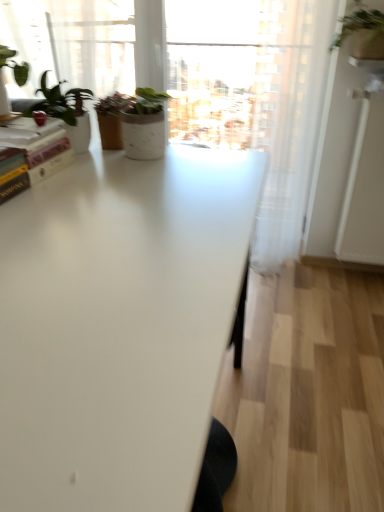
What is the approximate width of white glossy table at center?

white glossy table at center is 30.93 inches wide.

Where is `hardcover book at upper left`? Image resolution: width=384 pixels, height=512 pixels. hardcover book at upper left is located at coordinates (31, 157).

Describe the element at coordinates (365, 185) in the screenshot. I see `white glossy screen door at right` at that location.

The image size is (384, 512). Describe the element at coordinates (225, 70) in the screenshot. I see `transparent glass window at upper center` at that location.

You are a GUI agent. You are given a task and a screenshot of the screen. Output one action in this format:
    pyautogui.click(x=<x>, y=<y>)
    Task: Click on the green matte plant at upper right
    
    Given the screenshot: What is the action you would take?
    pyautogui.click(x=363, y=31)

Is there a large distance between white glossy table at center and green matte plant pot at upper left?

That's right, there is a large distance between white glossy table at center and green matte plant pot at upper left.

How far apart are white glossy table at center and green matte plant pot at upper left?

white glossy table at center and green matte plant pot at upper left are 4.89 feet apart from each other.

Between white glossy table at center and green matte plant pot at upper left, which one has more height?

With more height is white glossy table at center.

Considering the relative sizes of white glossy table at center and green matte plant pot at upper left in the image provided, is white glossy table at center thinner than green matte plant pot at upper left?

No.

Is white glossy table at center not close to green matte plant at upper right?

Yes.

How much distance is there between white glossy table at center and green matte plant at upper right?

A distance of 5.01 feet exists between white glossy table at center and green matte plant at upper right.

Does point (163, 245) lie behind point (371, 36)?

No.

What's the angular difference between white glossy table at center and green matte plant at upper right's facing directions?

They differ by 90 degrees in their facing directions.

Does green matte plant pot at upper left have a greater width compared to white glossy screen door at right?

Indeed, green matte plant pot at upper left has a greater width compared to white glossy screen door at right.

Is green matte plant pot at upper left aimed at white glossy screen door at right?

No, green matte plant pot at upper left is not turned towards white glossy screen door at right.

Considering the relative positions of green matte plant pot at upper left and white glossy screen door at right in the image provided, is green matte plant pot at upper left to the right of white glossy screen door at right from the viewer's perspective?

Incorrect, green matte plant pot at upper left is not on the right side of white glossy screen door at right.

Could white glossy screen door at right be considered to be inside green matte plant pot at upper left?

No, white glossy screen door at right is located outside of green matte plant pot at upper left.

Is point (89, 414) closer or farther from the camera than point (190, 18)?

Point (89, 414) is closer to the camera than point (190, 18).

Between white glossy table at center and transparent glass window at upper center, which one has larger width?

white glossy table at center.

Where is `table that appears in front of the transparent glass window at upper center`? table that appears in front of the transparent glass window at upper center is located at coordinates (119, 325).

Is white glossy table at center placed right next to transparent glass window at upper center?

No.

Considering the positions of objects white glossy screen door at right and green matte plant at upper right in the image provided, who is more to the left, white glossy screen door at right or green matte plant at upper right?

Positioned to the left is green matte plant at upper right.

How much distance is there between white glossy screen door at right and green matte plant at upper right?

They are 18.06 inches apart.

Is green matte plant at upper right located within white glossy screen door at right?

No, green matte plant at upper right is not surrounded by white glossy screen door at right.

From a real-world perspective, is white glossy screen door at right positioned above or below green matte plant at upper right?

In terms of real-world spatial position, white glossy screen door at right is below green matte plant at upper right.

Considering the sizes of objects hardcover book at upper left and green matte plant pot at upper left in the image provided, who is shorter, hardcover book at upper left or green matte plant pot at upper left?

With less height is hardcover book at upper left.

Is hardcover book at upper left positioned with its back to green matte plant pot at upper left?

hardcover book at upper left is not turned away from green matte plant pot at upper left.

Is hardcover book at upper left to the right of green matte plant pot at upper left from the viewer's perspective?

No, hardcover book at upper left is not to the right of green matte plant pot at upper left.

Who is bigger, hardcover book at upper left or green matte plant pot at upper left?

Bigger between the two is green matte plant pot at upper left.

Which of these two, transparent glass window at upper center or white glossy table at center, stands taller?

With more height is white glossy table at center.

From the image's perspective, does transparent glass window at upper center appear higher than white glossy table at center?

Yes, from the image's perspective, transparent glass window at upper center is above white glossy table at center.

Which of these two, transparent glass window at upper center or white glossy table at center, is bigger?

With larger size is white glossy table at center.

Locate an element on the screen. This screenshot has width=384, height=512. bay window above the white glossy table at center (from the image's perspective) is located at coordinates (73, 42).

Where is `houseplant behind the white glossy table at center`? The width and height of the screenshot is (384, 512). houseplant behind the white glossy table at center is located at coordinates click(363, 31).

Looking at the image, which one is located further to green matte plant at upper right, green matte plant pot at upper left or white glossy table at center?

white glossy table at center is positioned further to the anchor green matte plant at upper right.

Based on their spatial positions, is transparent glass window at upper center or green matte plant pot at upper left closer to hardcover book at upper left?

green matte plant pot at upper left is positioned closer to the anchor hardcover book at upper left.

Considering their positions, is green matte plant at upper right positioned closer to transparent glass window at upper center than white glossy screen door at right?

white glossy screen door at right is positioned closer to the anchor transparent glass window at upper center.

Considering their positions, is transparent glass window at upper center positioned closer to white glossy screen door at right than white glossy table at center?

Among the two, white glossy table at center is located nearer to white glossy screen door at right.

When comparing their distances from white glossy screen door at right, does hardcover book at upper left or transparent glass window at upper center seem further?

transparent glass window at upper center is further to white glossy screen door at right.

Estimate the real-world distances between objects in this image. Which object is closer to hardcover book at upper left, green matte plant at upper right or green matte plant pot at upper left?

Based on the image, green matte plant pot at upper left appears to be nearer to hardcover book at upper left.

From the image, which object appears to be nearer to green matte plant pot at upper left, transparent glass window at upper center or green matte plant at upper right?

green matte plant at upper right is closer to green matte plant pot at upper left.

From the image, which object appears to be nearer to transparent glass window at upper center, white glossy table at center or green matte plant pot at upper left?

green matte plant pot at upper left lies closer to transparent glass window at upper center than the other object.

You are a GUI agent. You are given a task and a screenshot of the screen. Output one action in this format:
    pyautogui.click(x=<x>, y=<y>)
    Task: Click on the screen door between white glossy table at center and transparent glass window at upper center in the front-back direction
    Image resolution: width=384 pixels, height=512 pixels.
    Given the screenshot: What is the action you would take?
    point(365,185)

This screenshot has width=384, height=512. In order to click on window situated between green matte plant pot at upper left and white glossy screen door at right from left to right in this screenshot , I will do `click(225, 70)`.

Where is `houseplant between white glossy table at center and white glossy screen door at right from front to back`? houseplant between white glossy table at center and white glossy screen door at right from front to back is located at coordinates (363, 31).

Find the location of a particular element. book positioned between white glossy table at center and white glossy screen door at right from near to far is located at coordinates (31, 157).